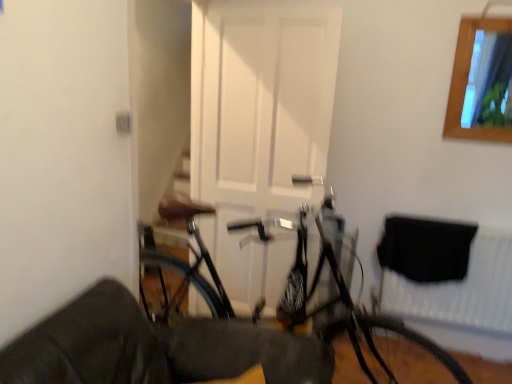
Identify the location of free region under black fabric at lower right (from a real-world perspective). The height and width of the screenshot is (384, 512). (433, 341).